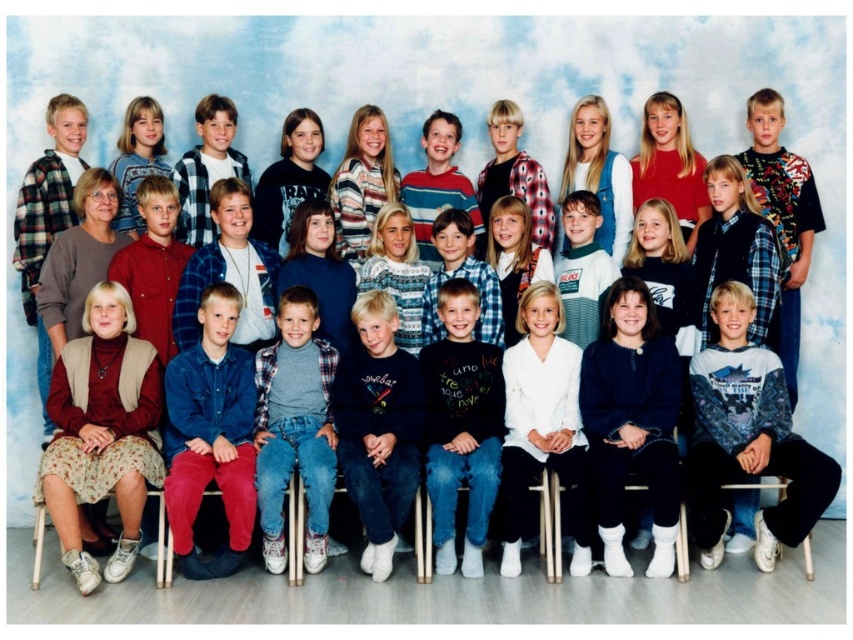
You are a photographer who needs to adjust the distance between two subjects in the group photo. The subjects are wearing the white cotton shirt at center and the striped sweater at center. According to the image, how far apart are these two subjects?

The white cotton shirt at center and the striped sweater at center are 2.76 meters apart.